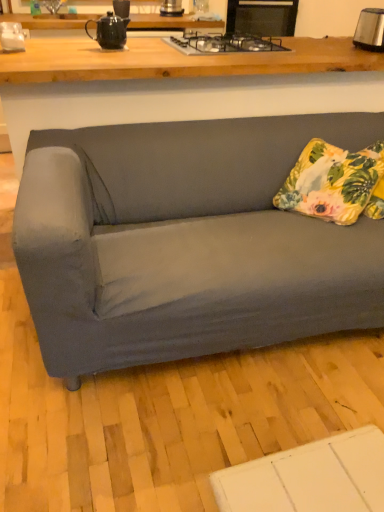
Question: Can you confirm if satin silver toaster at upper right is smaller than black glass gas stove at upper center?

Choices:
 (A) yes
 (B) no

Answer: (A)

Question: Is satin silver toaster at upper right at the left side of black glass gas stove at upper center?

Choices:
 (A) no
 (B) yes

Answer: (A)

Question: Can you confirm if satin silver toaster at upper right is taller than black glass gas stove at upper center?

Choices:
 (A) no
 (B) yes

Answer: (B)

Question: Is satin silver toaster at upper right shorter than black glass gas stove at upper center?

Choices:
 (A) yes
 (B) no

Answer: (B)

Question: From the image's perspective, is satin silver toaster at upper right on black glass gas stove at upper center?

Choices:
 (A) yes
 (B) no

Answer: (A)

Question: From a real-world perspective, is satin silver toaster at upper right on top of black glass gas stove at upper center?

Choices:
 (A) no
 (B) yes

Answer: (B)

Question: Is matte wood desk at upper center completely or partially inside floral fabric pillow at right?

Choices:
 (A) no
 (B) yes

Answer: (A)

Question: From a real-world perspective, is floral fabric pillow at right on top of matte wood desk at upper center?

Choices:
 (A) no
 (B) yes

Answer: (B)

Question: From the image's perspective, is floral fabric pillow at right under matte wood desk at upper center?

Choices:
 (A) yes
 (B) no

Answer: (A)

Question: Is floral fabric pillow at right oriented towards matte wood desk at upper center?

Choices:
 (A) no
 (B) yes

Answer: (A)

Question: Is floral fabric pillow at right taller than matte wood desk at upper center?

Choices:
 (A) no
 (B) yes

Answer: (A)

Question: Is floral fabric pillow at right oriented away from matte wood desk at upper center?

Choices:
 (A) yes
 (B) no

Answer: (A)

Question: Considering the relative sizes of matte black teapot at upper center and floral fabric pillow at right in the image provided, is matte black teapot at upper center wider than floral fabric pillow at right?

Choices:
 (A) no
 (B) yes

Answer: (A)